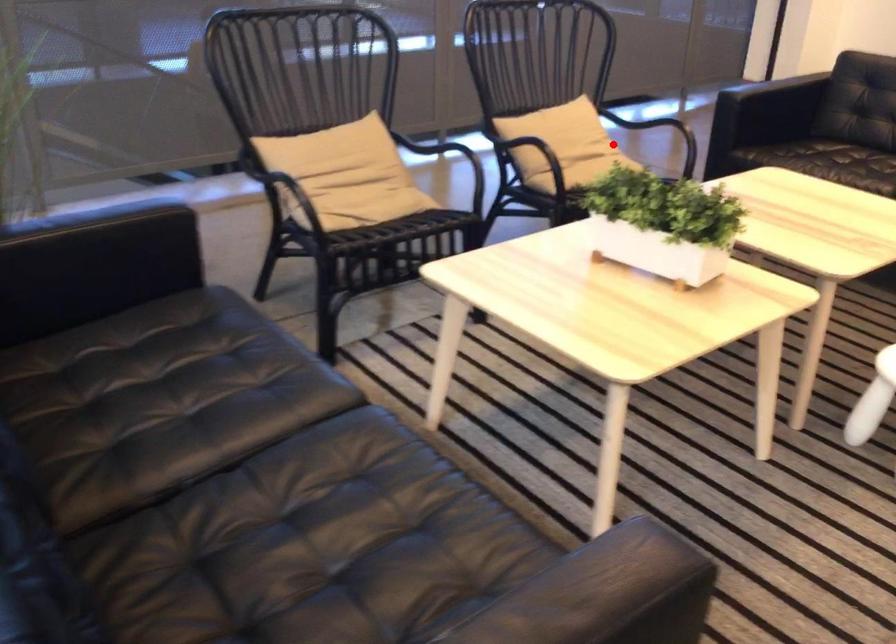
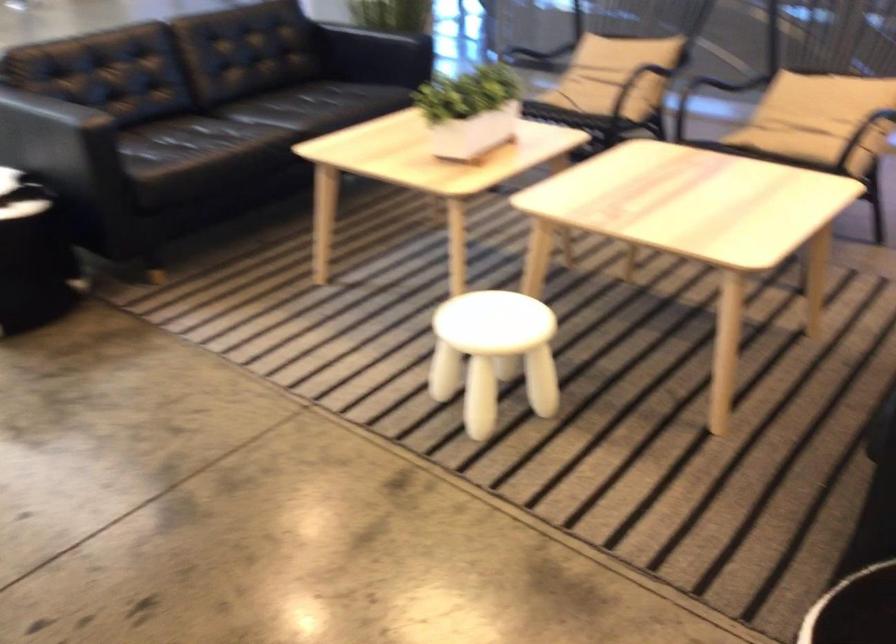
Question: A red point is marked in image1. In image2, is the corresponding 3D point closer to the camera or farther? Reply with the corresponding letter.

Choices:
 (A) The corresponding 3D point is closer.
 (B) The corresponding 3D point is farther.

Answer: (A)